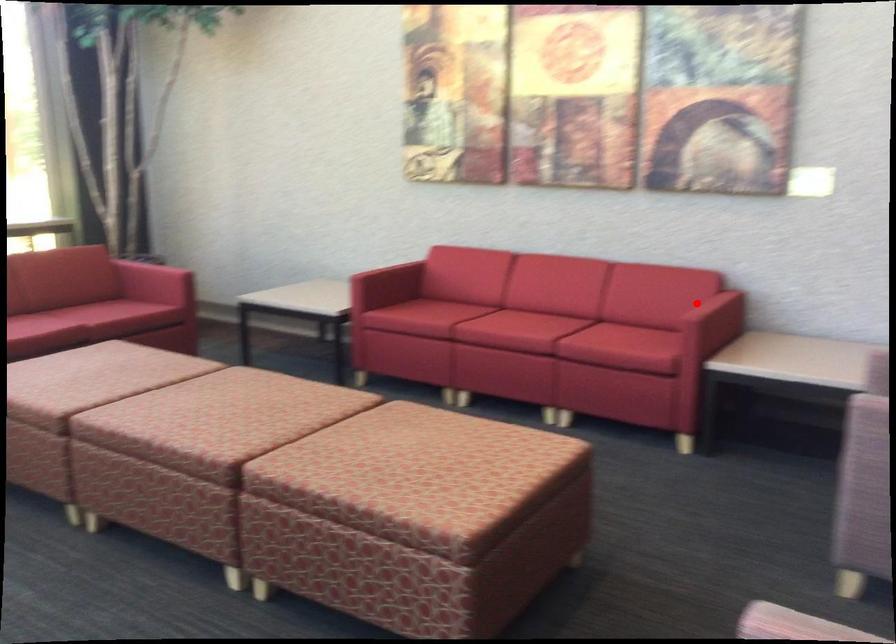
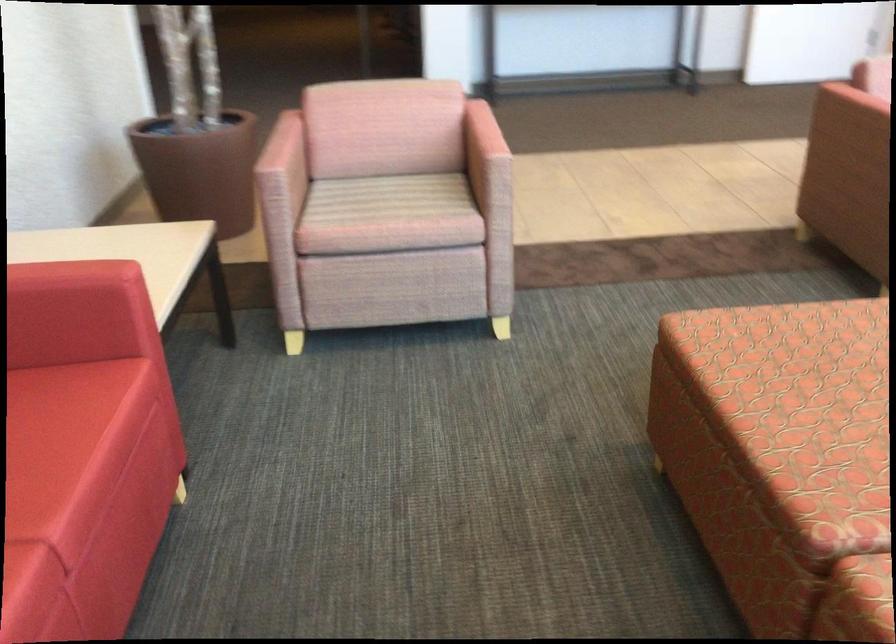
Question: A red point is marked in image1. In image2, is the corresponding 3D point closer to the camera or farther? Reply with the corresponding letter.

Choices:
 (A) The corresponding 3D point is closer.
 (B) The corresponding 3D point is farther.

Answer: (A)